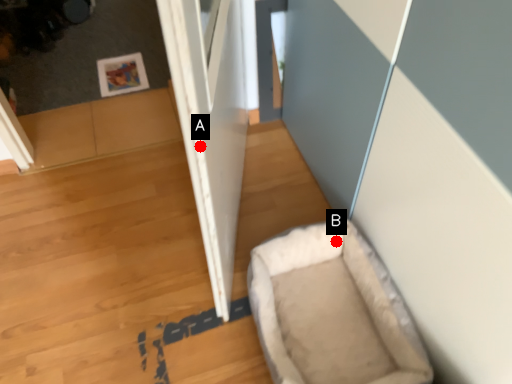
Question: Two points are circled on the image, labeled by A and B beside each circle. Which point is farther from the camera taking this photo?

Choices:
 (A) A is further
 (B) B is further

Answer: (B)